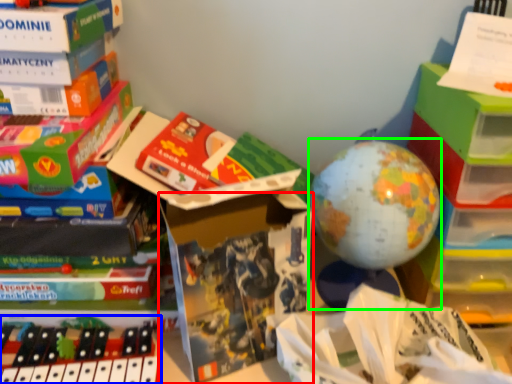
Question: Which object is the closest to the paperback book (highlighted by a red box)? Choose among these: toy (highlighted by a blue box) or toy (highlighted by a green box).

Choices:
 (A) toy
 (B) toy

Answer: (B)